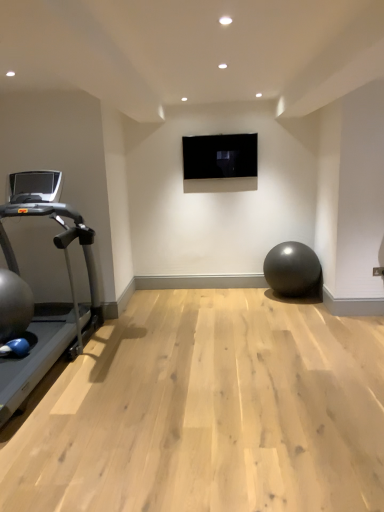
Question: Is silver metallic treadmill at left completely or partially outside of metallic gray ball at center?

Choices:
 (A) no
 (B) yes

Answer: (B)

Question: Is silver metallic treadmill at left facing away from metallic gray ball at center?

Choices:
 (A) no
 (B) yes

Answer: (A)

Question: Are silver metallic treadmill at left and metallic gray ball at center located far from each other?

Choices:
 (A) yes
 (B) no

Answer: (A)

Question: Is silver metallic treadmill at left further to camera compared to metallic gray ball at center?

Choices:
 (A) yes
 (B) no

Answer: (B)

Question: Is silver metallic treadmill at left surrounding metallic gray ball at center?

Choices:
 (A) no
 (B) yes

Answer: (A)

Question: Does silver metallic treadmill at left have a smaller size compared to metallic gray ball at center?

Choices:
 (A) yes
 (B) no

Answer: (B)

Question: Would you say silver metallic treadmill at left is part of metallic gray ball at center's contents?

Choices:
 (A) no
 (B) yes

Answer: (A)

Question: Does metallic gray ball at center appear on the right side of silver metallic treadmill at left?

Choices:
 (A) yes
 (B) no

Answer: (A)

Question: From a real-world perspective, is metallic gray ball at center located beneath silver metallic treadmill at left?

Choices:
 (A) no
 (B) yes

Answer: (B)

Question: Is metallic gray ball at center shorter than silver metallic treadmill at left?

Choices:
 (A) no
 (B) yes

Answer: (B)

Question: Considering the relative sizes of metallic gray ball at center and silver metallic treadmill at left in the image provided, is metallic gray ball at center taller than silver metallic treadmill at left?

Choices:
 (A) no
 (B) yes

Answer: (A)

Question: From the image's perspective, does metallic gray ball at center appear lower than silver metallic treadmill at left?

Choices:
 (A) yes
 (B) no

Answer: (A)

Question: Would you say silver metallic treadmill at left is inside or outside metallic gray ball at center?

Choices:
 (A) outside
 (B) inside

Answer: (A)